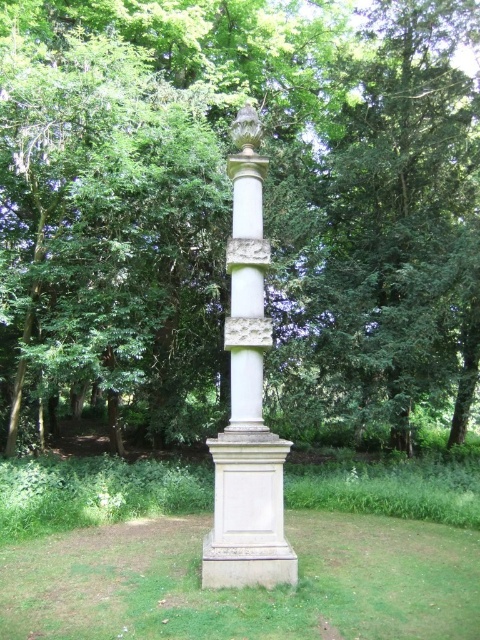
Question: Which point is closer to the camera?

Choices:
 (A) green leafy tree at center
 (B) white stone column at center

Answer: (B)

Question: Can you confirm if green leafy tree at center is positioned above white stone column at center?

Choices:
 (A) yes
 (B) no

Answer: (A)

Question: Among these points, which one is nearest to the camera?

Choices:
 (A) (182, 184)
 (B) (239, 346)

Answer: (B)

Question: Is green leafy tree at center closer to camera compared to white stone column at center?

Choices:
 (A) yes
 (B) no

Answer: (B)

Question: Can you confirm if green leafy tree at center is positioned to the left of white stone column at center?

Choices:
 (A) yes
 (B) no

Answer: (B)